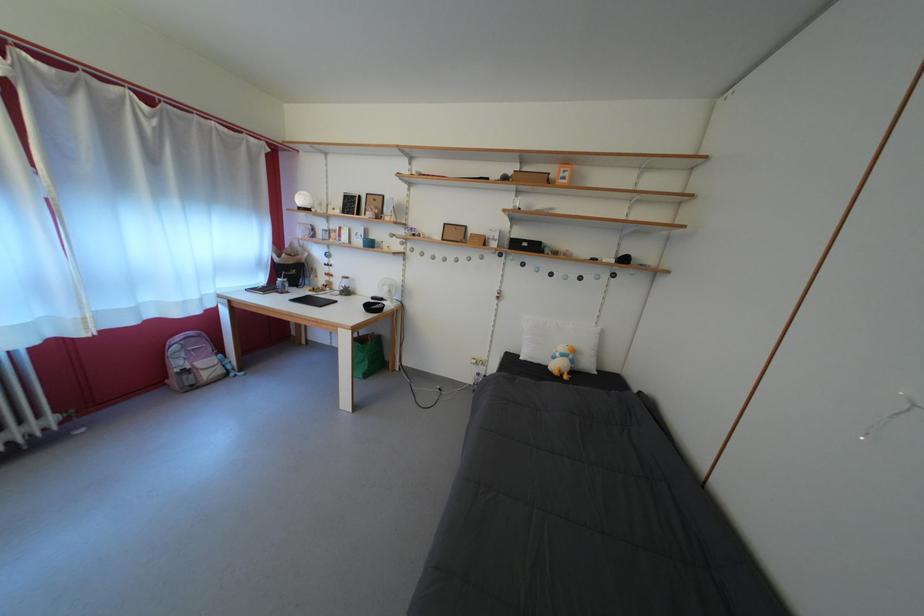
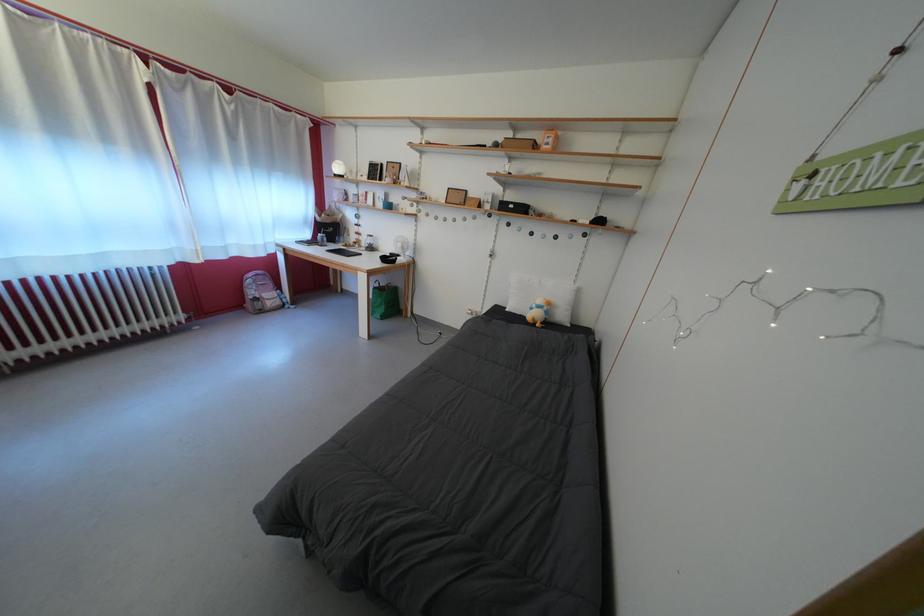
Find the pixel in the second image that matches the point at 395,294 in the first image.

(407, 251)